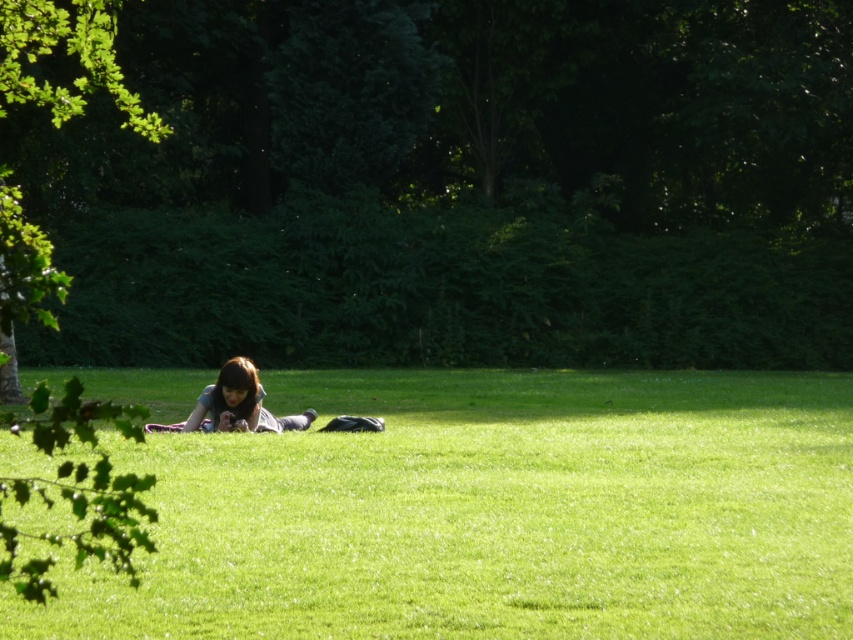
You are a photographer trying to capture a closeup shot of the green grass at center and the dark brown hair at center. Which object should you focus on first if you want to ensure both are in focus without adjusting the camera settings?

The green grass at center is taller than the dark brown hair at center, so focusing on the green grass at center first will ensure both are in focus since it is farther away.